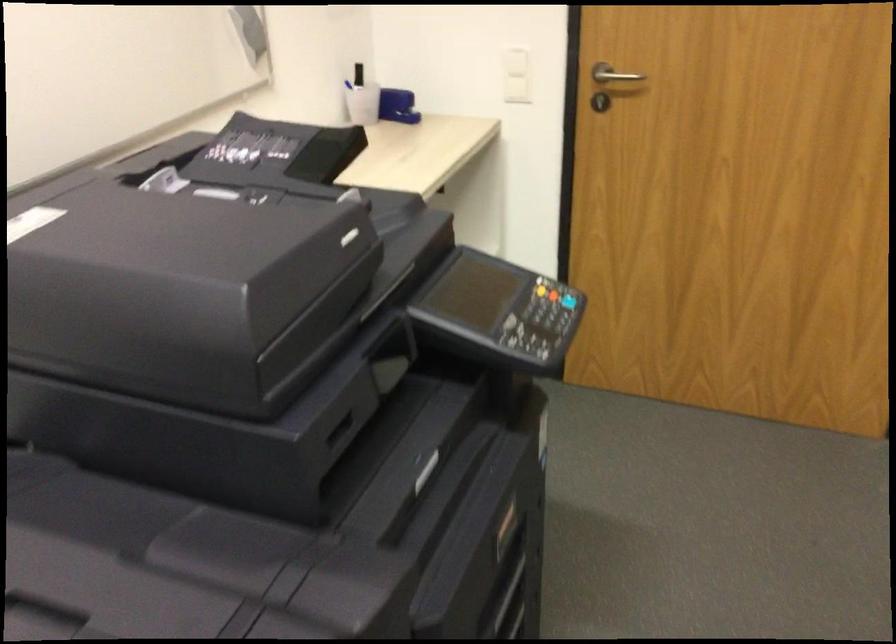
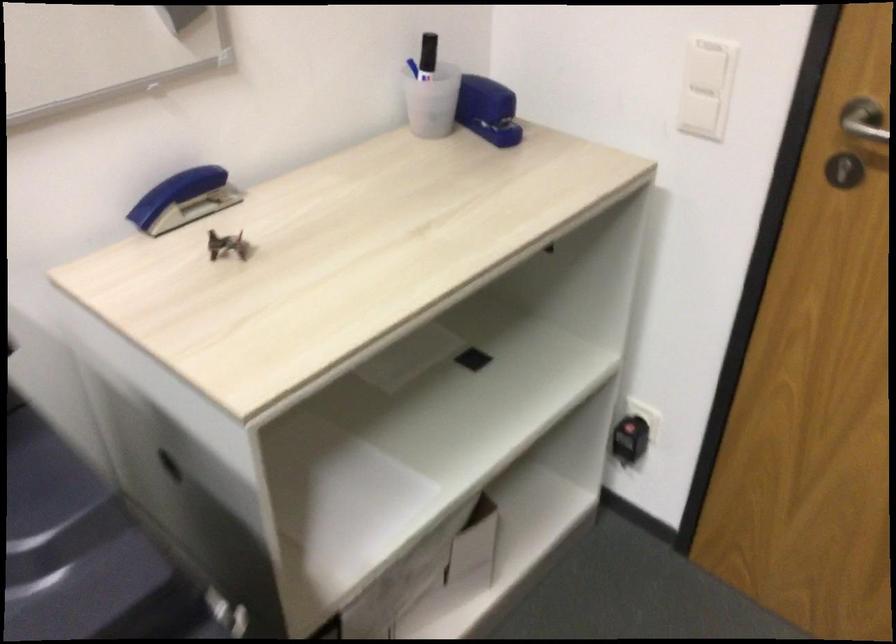
Where in the second image is the point corresponding to pixel 362 73 from the first image?

(428, 55)